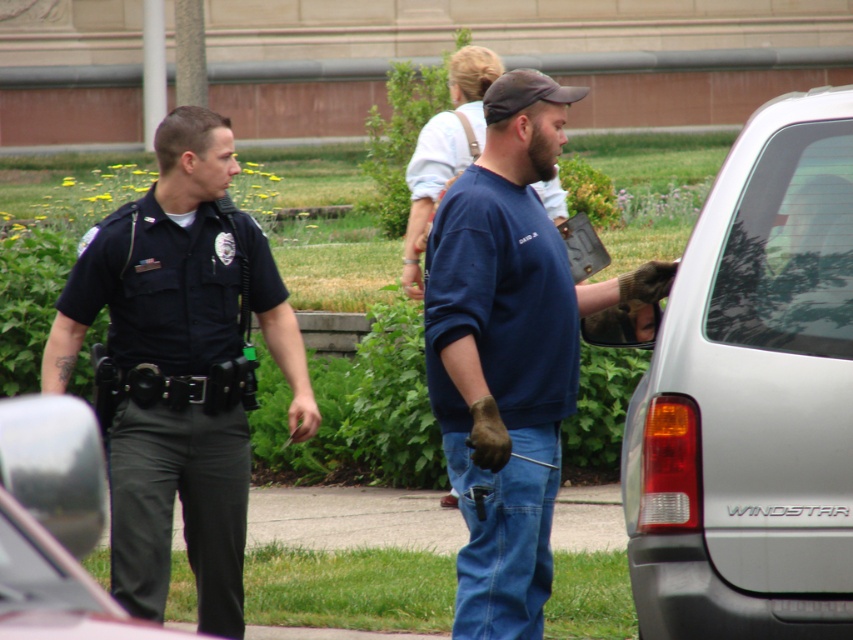
Question: Is silver metallic van at right to the right of blue cotton shirt at center from the viewer's perspective?

Choices:
 (A) yes
 (B) no

Answer: (A)

Question: Among these points, which one is farthest from the camera?

Choices:
 (A) (212, 416)
 (B) (18, 608)

Answer: (A)

Question: Which is nearer to the black matte pants at left?

Choices:
 (A) blue cotton shirt at center
 (B) dark blue uniform at left

Answer: (A)

Question: Which object is closer to the camera taking this photo?

Choices:
 (A) blue cotton shirt at center
 (B) silver metallic van at right
 (C) blue cotton sweatshirt at center
 (D) dark blue uniform at left

Answer: (B)

Question: Is the position of silver metallic van at right more distant than that of black matte pants at left?

Choices:
 (A) yes
 (B) no

Answer: (A)

Question: Does dark blue uniform at left appear on the left side of blue cotton shirt at center?

Choices:
 (A) no
 (B) yes

Answer: (B)